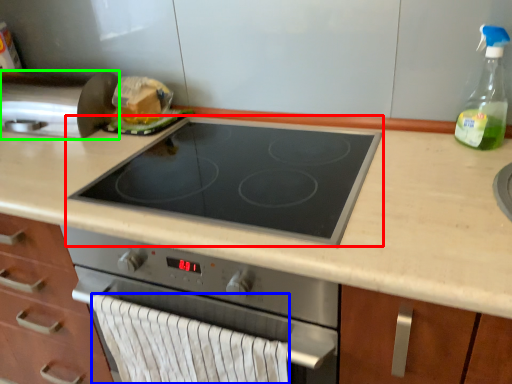
Question: Which object is positioned farthest from gas stove (highlighted by a red box)? Select from hand towel (highlighted by a blue box) and kitchen appliance (highlighted by a green box).

Choices:
 (A) hand towel
 (B) kitchen appliance

Answer: (B)